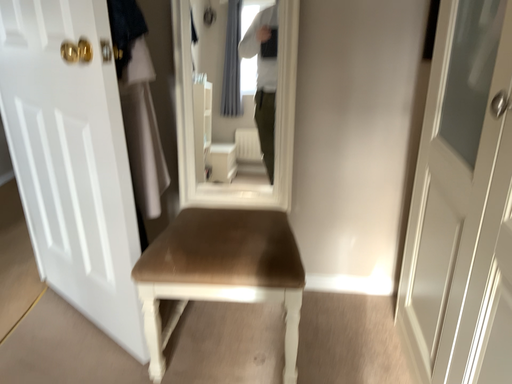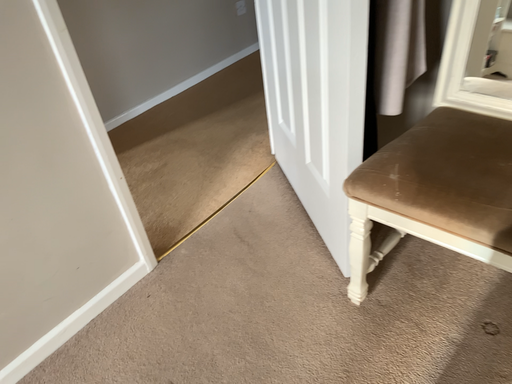
Question: Which way did the camera rotate in the video?

Choices:
 (A) rotated left
 (B) rotated right

Answer: (A)